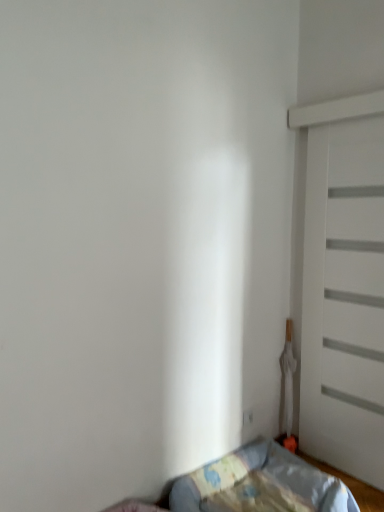
Based on the photo, what is the approximate height of fluffy fabric bed at lower right?

8.39 inches.

What do you see at coordinates (307, 481) in the screenshot? Image resolution: width=384 pixels, height=512 pixels. I see `fluffy fabric bed at lower right` at bounding box center [307, 481].

This screenshot has height=512, width=384. In order to click on fluffy fabric bed at lower right in this screenshot , I will do `click(307, 481)`.

The width and height of the screenshot is (384, 512). I want to click on fluffy fabric bed at lower right, so [307, 481].